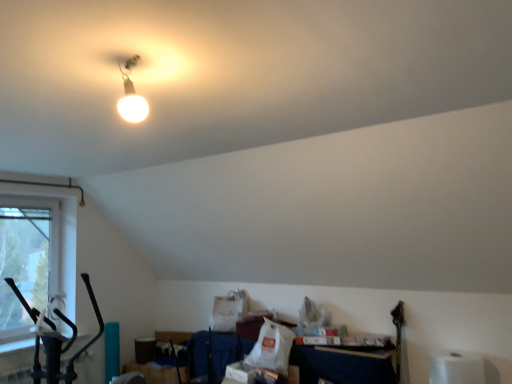
In order to click on matte white bulb at upper center in this screenshot , I will do `click(131, 93)`.

What do you see at coordinates (34, 259) in the screenshot? Image resolution: width=512 pixels, height=384 pixels. I see `clear glass window at left` at bounding box center [34, 259].

The height and width of the screenshot is (384, 512). In order to click on white matte toilet paper at lower right in this screenshot , I will do `click(456, 368)`.

The width and height of the screenshot is (512, 384). What are the coordinates of `matte white bulb at upper center` in the screenshot? It's located at (131, 93).

Consider the image. Considering the sizes of matte white bulb at upper center and clear glass window at left in the image, is matte white bulb at upper center wider or thinner than clear glass window at left?

Considering their sizes, matte white bulb at upper center looks broader than clear glass window at left.

Which is in front, matte white bulb at upper center or clear glass window at left?

matte white bulb at upper center is closer to the camera.

Is matte white bulb at upper center far from clear glass window at left?

matte white bulb at upper center is far away from clear glass window at left.

Which is more to the left, matte white bulb at upper center or clear glass window at left?

Positioned to the left is clear glass window at left.

In the scene shown: From the image's perspective, is clear glass window at left on white matte toilet paper at lower right?

Yes, from the image's perspective, clear glass window at left is on top of white matte toilet paper at lower right.

Looking at this image, is the position of clear glass window at left less distant than that of white matte toilet paper at lower right?

No, clear glass window at left is further to the viewer.

Measure the distance between clear glass window at left and white matte toilet paper at lower right.

The distance of clear glass window at left from white matte toilet paper at lower right is 12.35 feet.

Is clear glass window at left surrounding white matte toilet paper at lower right?

No.

Can we say white matte toilet paper at lower right lies outside clear glass window at left?

white matte toilet paper at lower right is positioned outside clear glass window at left.

Is white matte toilet paper at lower right with clear glass window at left?

No, white matte toilet paper at lower right is not with clear glass window at left.

Which object is wider, white matte toilet paper at lower right or clear glass window at left?

white matte toilet paper at lower right is wider.

Find the location of a particular element. The image size is (512, 384). window lying behind the white matte toilet paper at lower right is located at coordinates (34, 259).

From the image's perspective, would you say matte white bulb at upper center is shown under white matte toilet paper at lower right?

No, from the image's perspective, matte white bulb at upper center is not below white matte toilet paper at lower right.

Does matte white bulb at upper center lie behind white matte toilet paper at lower right?

No, matte white bulb at upper center is closer to the camera.

Looking at this image, is matte white bulb at upper center not within white matte toilet paper at lower right?

Absolutely, matte white bulb at upper center is external to white matte toilet paper at lower right.

Considering the positions of objects matte white bulb at upper center and white matte toilet paper at lower right in the image provided, who is more to the left, matte white bulb at upper center or white matte toilet paper at lower right?

Positioned to the left is matte white bulb at upper center.

Where is `lamp in front of the white matte toilet paper at lower right`? This screenshot has width=512, height=384. lamp in front of the white matte toilet paper at lower right is located at coordinates (131, 93).

From a real-world perspective, is white matte toilet paper at lower right positioned over matte white bulb at upper center based on gravity?

No, from a real-world perspective, white matte toilet paper at lower right is not above matte white bulb at upper center.

Is point (437, 379) in front of point (129, 95)?

No, it is behind (129, 95).

Between white matte toilet paper at lower right and matte white bulb at upper center, which one has larger size?

white matte toilet paper at lower right is bigger.

From a real-world perspective, between clear glass window at left and matte white bulb at upper center, who is vertically higher?

From a 3D spatial view, matte white bulb at upper center is above.

How different are the orientations of clear glass window at left and matte white bulb at upper center in degrees?

There is a 1.63-degree angle between the facing directions of clear glass window at left and matte white bulb at upper center.

Is matte white bulb at upper center a part of clear glass window at left?

No, clear glass window at left does not contain matte white bulb at upper center.

Based on the photo, from the image's perspective, which one is positioned lower, clear glass window at left or matte white bulb at upper center?

clear glass window at left, from the image's perspective.

At what (x,y) coordinates should I click in order to perform the action: click on lamp that is above the clear glass window at left (from a real-world perspective). Please return your answer as a coordinate pair (x, y). Looking at the image, I should click on (131, 93).

This screenshot has height=384, width=512. I want to click on window behind the white matte toilet paper at lower right, so click(34, 259).

Based on their spatial positions, is matte white bulb at upper center or clear glass window at left further from white matte toilet paper at lower right?

Answer: clear glass window at left lies further to white matte toilet paper at lower right than the other object.

Looking at the image, which one is located closer to clear glass window at left, white matte toilet paper at lower right or matte white bulb at upper center?

Based on the image, matte white bulb at upper center appears to be nearer to clear glass window at left.

Which object lies nearer to the anchor point matte white bulb at upper center, white matte toilet paper at lower right or clear glass window at left?

Based on the image, clear glass window at left appears to be nearer to matte white bulb at upper center.

When comparing their distances from white matte toilet paper at lower right, does clear glass window at left or matte white bulb at upper center seem closer?

The object closer to white matte toilet paper at lower right is matte white bulb at upper center.

Considering their positions, is clear glass window at left positioned closer to matte white bulb at upper center than white matte toilet paper at lower right?

Among the two, clear glass window at left is located nearer to matte white bulb at upper center.

Which object lies nearer to the anchor point clear glass window at left, matte white bulb at upper center or white matte toilet paper at lower right?

matte white bulb at upper center is positioned closer to the anchor clear glass window at left.

Identify the location of lamp between clear glass window at left and white matte toilet paper at lower right. (131, 93).